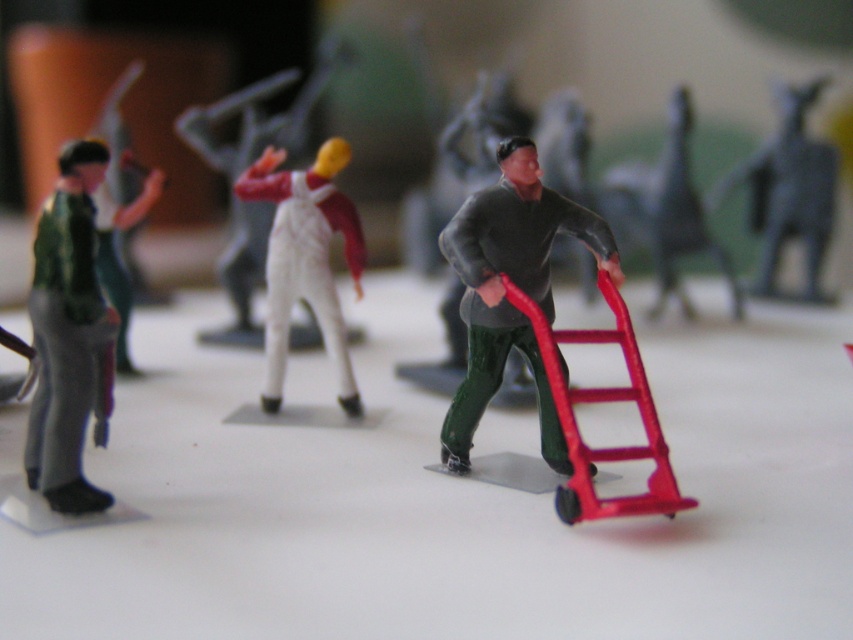
Question: Is green matte figure at center to the right of metallic red hand truck at center-right from the viewer's perspective?

Choices:
 (A) no
 (B) yes

Answer: (A)

Question: Among these points, which one is farthest from the camera?

Choices:
 (A) (686, 176)
 (B) (595, 332)
 (C) (142, 196)

Answer: (A)

Question: Estimate the real-world distances between objects in this image. Which object is closer to the white matte figure at center?

Choices:
 (A) green matte figure at left
 (B) green matte figure at center
 (C) white plastic figure at center

Answer: (B)

Question: Which object appears farthest from the camera in this image?

Choices:
 (A) metallic red hand truck at center
 (B) smooth gray cat at upper right

Answer: (B)

Question: Can you confirm if white plastic figure at center is wider than metallic red hand truck at center?

Choices:
 (A) no
 (B) yes

Answer: (B)

Question: In this image, where is smooth gray cat at upper right located relative to metallic red hand truck at center?

Choices:
 (A) above
 (B) below

Answer: (A)